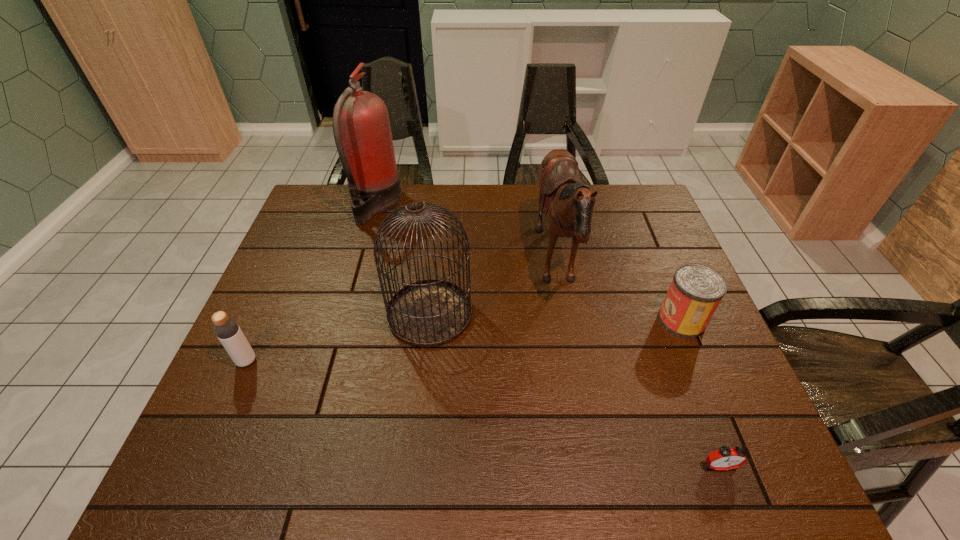
This screenshot has width=960, height=540. I want to click on free space located 0.350m on the back of the saddle, so pyautogui.click(x=412, y=266).

Where is `free space located on the back of the saddle`? free space located on the back of the saddle is located at coordinates (496, 266).

Image resolution: width=960 pixels, height=540 pixels. I want to click on vacant region located on the back of the birdcage, so click(x=435, y=268).

The image size is (960, 540). I want to click on free region located on the back of the leftmost object, so click(x=290, y=264).

Where is `vacant point located on the front of the can`? This screenshot has height=540, width=960. vacant point located on the front of the can is located at coordinates (699, 363).

Find the location of a particular element. The image size is (960, 540). fire extinguisher that is at the far edge is located at coordinates (361, 127).

Image resolution: width=960 pixels, height=540 pixels. What are the coordinates of `saddle that is at the far edge` in the screenshot? It's located at (568, 203).

This screenshot has height=540, width=960. What are the coordinates of `object positioned at the near edge` in the screenshot? It's located at (725, 458).

Locate an element on the screen. fire extinguisher that is at the left edge is located at coordinates (361, 127).

I want to click on bottle present at the left edge, so click(227, 330).